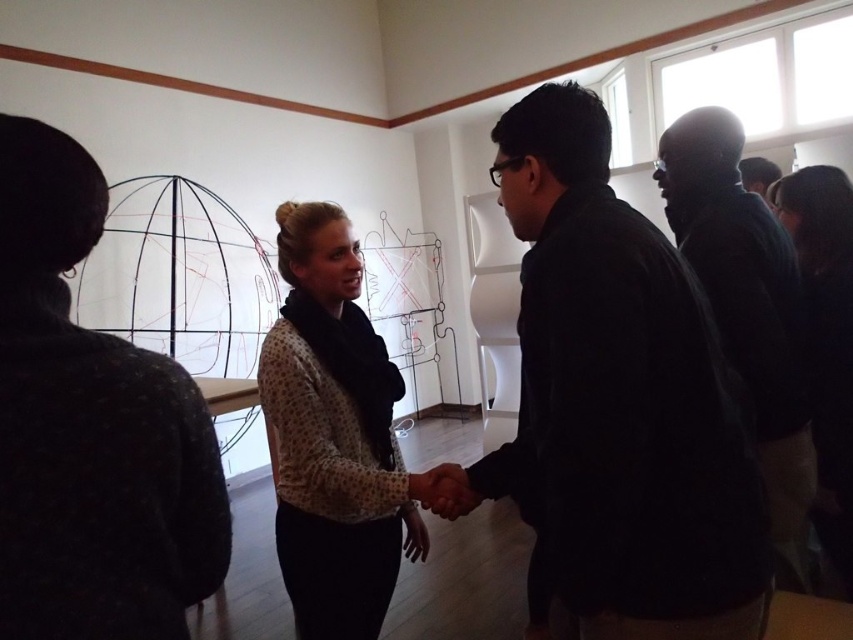
Based on the scene description, which clothing item is positioned higher between the dark gray sweater at left and the matte black shirt at right?

The dark gray sweater at left is positioned higher than the matte black shirt at right.

You are an observer standing in front of the handshake scene. You notice the dark gray sweater at left and the matte black shirt at right. Which clothing item has a longer length?

The matte black shirt at right is longer than the dark gray sweater at left.